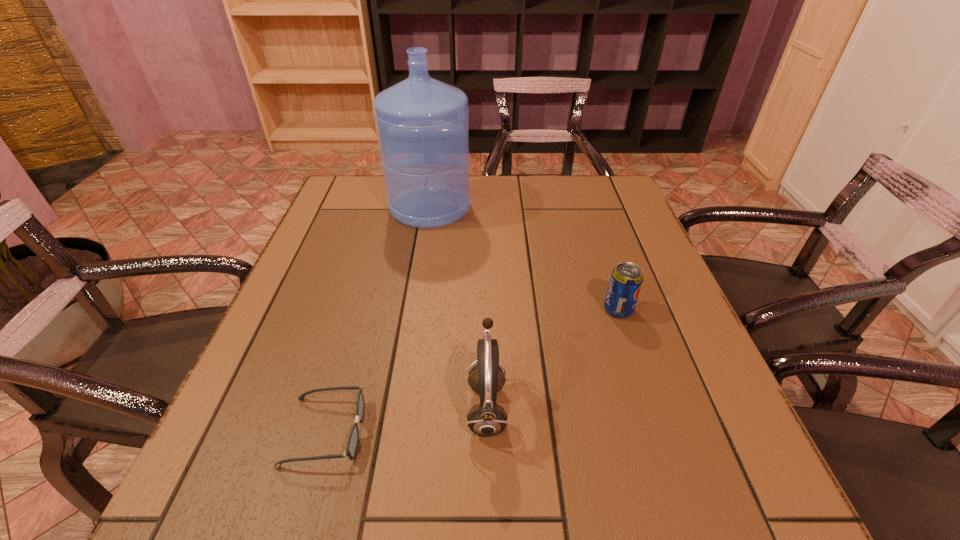
At what (x,y) coordinates should I click in order to perform the action: click on the tallest object. Please return your answer as a coordinate pair (x, y). Looking at the image, I should click on (423, 124).

Locate an element on the screen. the farthest object is located at coordinates (423, 124).

This screenshot has width=960, height=540. In order to click on the third shortest object in this screenshot , I will do [x=487, y=418].

Image resolution: width=960 pixels, height=540 pixels. I want to click on the second object from right to left, so click(x=487, y=418).

This screenshot has width=960, height=540. Find the location of `the third tallest object`. the third tallest object is located at coordinates (626, 279).

Identify the location of soda. The width and height of the screenshot is (960, 540). (626, 279).

You are a GUI agent. You are given a task and a screenshot of the screen. Output one action in this format:
    pyautogui.click(x=<x>, y=<y>)
    Task: Click on the spectacles
    The image size is (960, 540).
    Given the screenshot: What is the action you would take?
    pyautogui.click(x=352, y=444)

Identify the location of free space located 0.080m on the side of the water jug with the handle. (435, 174).

Identify the location of free space located on the ear pads of the second tallest object. (265, 407).

At what (x,y) coordinates should I click in order to perform the action: click on vacant space located 0.200m on the ear pads of the second tallest object. Please return your answer as a coordinate pair (x, y). Image resolution: width=960 pixels, height=540 pixels. Looking at the image, I should click on (351, 407).